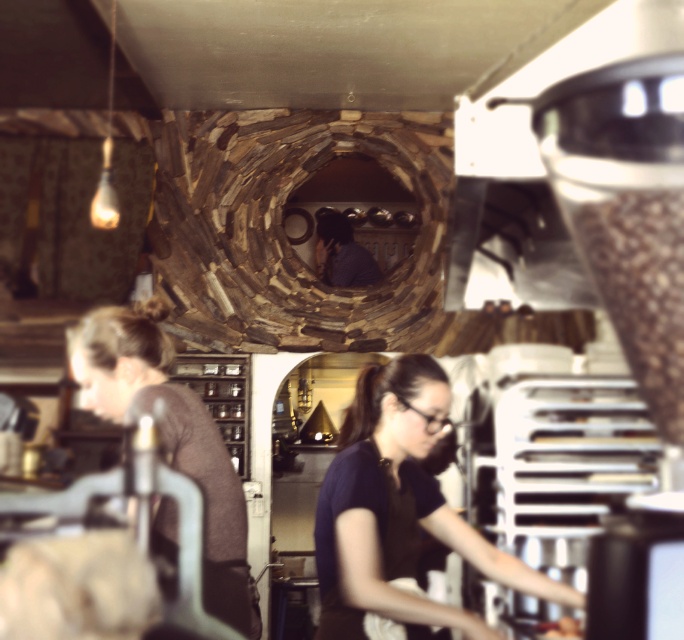
Is point (473, 620) positioned before point (161, 314)?

Yes, it is in front of point (161, 314).

Does black matte apron at lower center appear on the right side of matte brown hair at left?

Yes, black matte apron at lower center is to the right of matte brown hair at left.

This screenshot has width=684, height=640. In order to click on black matte apron at lower center in this screenshot , I will do `click(397, 509)`.